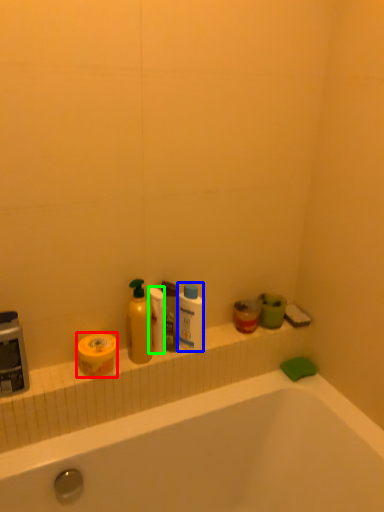
Question: Which is nearer to the mouthwash (highlighted by a red box)? cleaning product (highlighted by a blue box) or toilet paper (highlighted by a green box).

Choices:
 (A) cleaning product
 (B) toilet paper

Answer: (B)